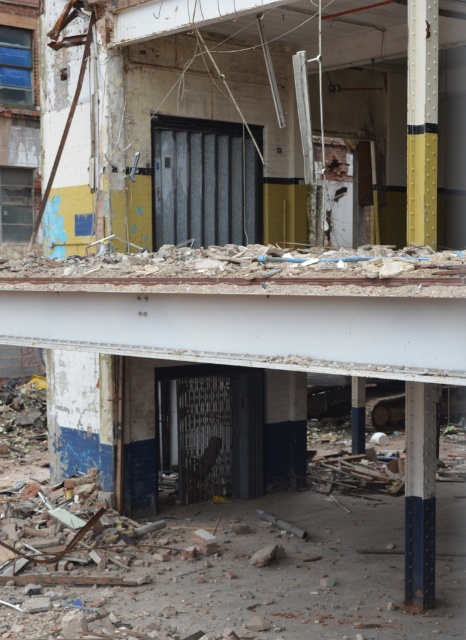
Question: Is yellow painted metal pole at upper right thinner than blue painted metal pole at lower right?

Choices:
 (A) no
 (B) yes

Answer: (B)

Question: Which point is closer to the camera?

Choices:
 (A) (431, 81)
 (B) (432, 520)

Answer: (A)

Question: Can you confirm if yellow painted metal pole at upper right is thinner than blue painted metal pole at lower right?

Choices:
 (A) no
 (B) yes

Answer: (B)

Question: Which object is farther from the camera taking this photo?

Choices:
 (A) blue painted metal pole at lower right
 (B) yellow painted metal pole at upper right

Answer: (B)

Question: Is yellow painted metal pole at upper right below blue painted metal pole at lower right?

Choices:
 (A) no
 (B) yes

Answer: (A)